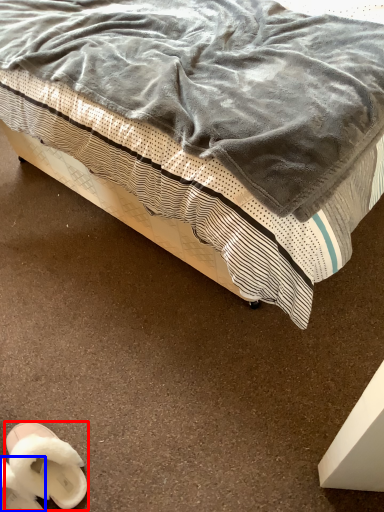
Question: Among these objects, which one is nearest to the camera, footwear (highlighted by a red box) or footwear (highlighted by a blue box)?

Choices:
 (A) footwear
 (B) footwear

Answer: (B)